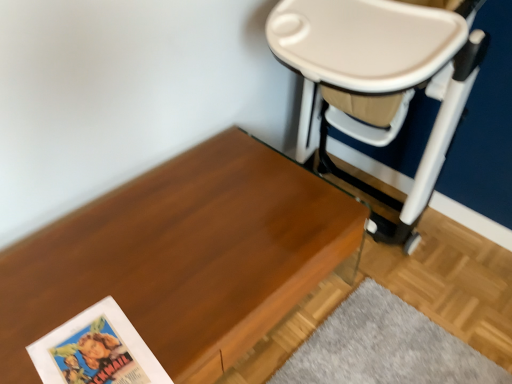
This screenshot has height=384, width=512. In order to click on wooden table at lower left in this screenshot , I will do `click(183, 257)`.

The height and width of the screenshot is (384, 512). In order to click on beige plastic swivel chair at upper right in this screenshot , I will do `click(379, 83)`.

This screenshot has width=512, height=384. Identify the location of matte paper paperback book at lower left. (96, 350).

From the image's perspective, which is above, matte paper paperback book at lower left or wooden table at lower left?

wooden table at lower left is shown above in the image.

From a real-world perspective, is matte paper paperback book at lower left physically above wooden table at lower left?

Yes, from a real-world perspective, matte paper paperback book at lower left is over wooden table at lower left

Is point (111, 315) closer or farther from the camera than point (288, 227)?

Point (111, 315).

Looking at this image, is matte paper paperback book at lower left placed right next to wooden table at lower left?

No.

Which is correct: beige plastic swivel chair at upper right is inside matte paper paperback book at lower left, or outside of it?

beige plastic swivel chair at upper right is not enclosed by matte paper paperback book at lower left.

Can you confirm if beige plastic swivel chair at upper right is bigger than matte paper paperback book at lower left?

Yes.

From a real-world perspective, between beige plastic swivel chair at upper right and matte paper paperback book at lower left, who is vertically lower?

From a 3D spatial view, matte paper paperback book at lower left is below.

Considering their positions, is beige plastic swivel chair at upper right located in front of or behind matte paper paperback book at lower left?

Clearly, beige plastic swivel chair at upper right is in front of matte paper paperback book at lower left.

Which object is thinner, beige plastic swivel chair at upper right or wooden table at lower left?

beige plastic swivel chair at upper right is thinner.

Is beige plastic swivel chair at upper right oriented away from wooden table at lower left?

That's not correct — beige plastic swivel chair at upper right is not looking away from wooden table at lower left.

Does point (438, 47) come behind point (111, 244)?

No, (438, 47) is in front of (111, 244).

From a real-world perspective, who is located higher, beige plastic swivel chair at upper right or wooden table at lower left?

beige plastic swivel chair at upper right is physically above.

Between wooden table at lower left and matte paper paperback book at lower left, which one appears on the right side from the viewer's perspective?

wooden table at lower left is more to the right.

From the image's perspective, relative to matte paper paperback book at lower left, is wooden table at lower left above or below?

wooden table at lower left is above matte paper paperback book at lower left.

Considering the sizes of objects wooden table at lower left and matte paper paperback book at lower left in the image provided, who is bigger, wooden table at lower left or matte paper paperback book at lower left?

wooden table at lower left is bigger.

Would you consider wooden table at lower left to be distant from matte paper paperback book at lower left?

wooden table at lower left is near matte paper paperback book at lower left, not far away.

Which is more to the right, matte paper paperback book at lower left or beige plastic swivel chair at upper right?

From the viewer's perspective, beige plastic swivel chair at upper right appears more on the right side.

What's the angular difference between matte paper paperback book at lower left and beige plastic swivel chair at upper right's facing directions?

86 degrees.

Looking at their sizes, would you say matte paper paperback book at lower left is wider or thinner than beige plastic swivel chair at upper right?

matte paper paperback book at lower left is thinner than beige plastic swivel chair at upper right.

Looking at this image, is matte paper paperback book at lower left positioned with its back to beige plastic swivel chair at upper right?

matte paper paperback book at lower left is not turned away from beige plastic swivel chair at upper right.

Is wooden table at lower left directly adjacent to beige plastic swivel chair at upper right?

wooden table at lower left is not next to beige plastic swivel chair at upper right, and they're not touching.

Is wooden table at lower left surrounding beige plastic swivel chair at upper right?

No, beige plastic swivel chair at upper right is not surrounded by wooden table at lower left.

At what (x,y) coordinates should I click in order to perform the action: click on swivel chair that appears above the wooden table at lower left (from a real-world perspective). Please return your answer as a coordinate pair (x, y). This screenshot has width=512, height=384. Looking at the image, I should click on (379, 83).

The width and height of the screenshot is (512, 384). What are the coordinates of `paperback book lying below the wooden table at lower left (from the image's perspective)` in the screenshot? It's located at (96, 350).

You are a GUI agent. You are given a task and a screenshot of the screen. Output one action in this format:
    pyautogui.click(x=<x>, y=<y>)
    Task: Click on the paperback book that is under the beige plastic swivel chair at upper right (from a real-world perspective)
    
    Given the screenshot: What is the action you would take?
    pyautogui.click(x=96, y=350)

Which object lies further to the anchor point wooden table at lower left, matte paper paperback book at lower left or beige plastic swivel chair at upper right?

The object further to wooden table at lower left is beige plastic swivel chair at upper right.

Which object lies nearer to the anchor point wooden table at lower left, beige plastic swivel chair at upper right or matte paper paperback book at lower left?

The object closer to wooden table at lower left is matte paper paperback book at lower left.

Estimate the real-world distances between objects in this image. Which object is further from matte paper paperback book at lower left, wooden table at lower left or beige plastic swivel chair at upper right?

The object further to matte paper paperback book at lower left is beige plastic swivel chair at upper right.

Looking at this image, from the image, which object appears to be nearer to matte paper paperback book at lower left, beige plastic swivel chair at upper right or wooden table at lower left?

Among the two, wooden table at lower left is located nearer to matte paper paperback book at lower left.

Considering their positions, is wooden table at lower left positioned further to beige plastic swivel chair at upper right than matte paper paperback book at lower left?

Based on the image, matte paper paperback book at lower left appears to be further to beige plastic swivel chair at upper right.

When comparing their distances from beige plastic swivel chair at upper right, does matte paper paperback book at lower left or wooden table at lower left seem closer?

The object closer to beige plastic swivel chair at upper right is wooden table at lower left.

In order to click on table that lies between beige plastic swivel chair at upper right and matte paper paperback book at lower left from top to bottom in this screenshot , I will do coord(183,257).